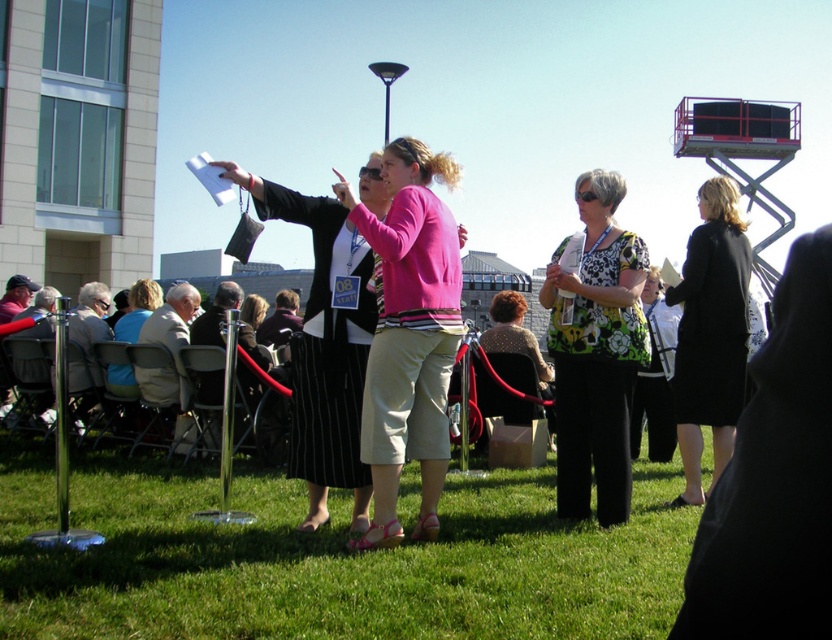
You are a photographer at this event and need to capture a photo that includes both the pink fabric shirt at center and the light brown wooden chairs at lower left. Given their sizes, which object should you focus on to ensure both fit in the frame?

The pink fabric shirt at center is bigger than the light brown wooden chairs at lower left. To ensure both fit in the frame, focus on the pink fabric shirt at center since it is larger and requires more space.

You are attending an outdoor event and want to take a photo of the floral print blouse at center and the black coat at center. Which one should you focus on first to ensure both are in focus?

Since the floral print blouse at center is closer to the viewer than the black coat at center, you should focus on the floral print blouse at center first to ensure both are in focus.